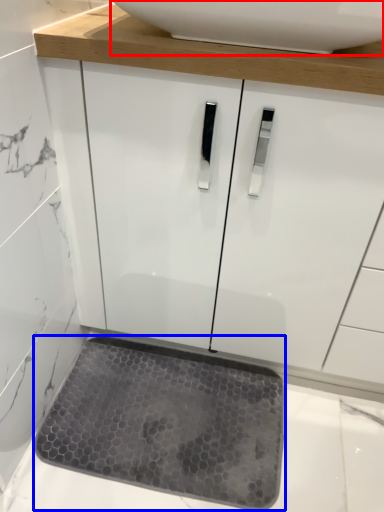
Question: Which of the following is the farthest to the observer, sink (highlighted by a red box) or mat (highlighted by a blue box)?

Choices:
 (A) sink
 (B) mat

Answer: (B)